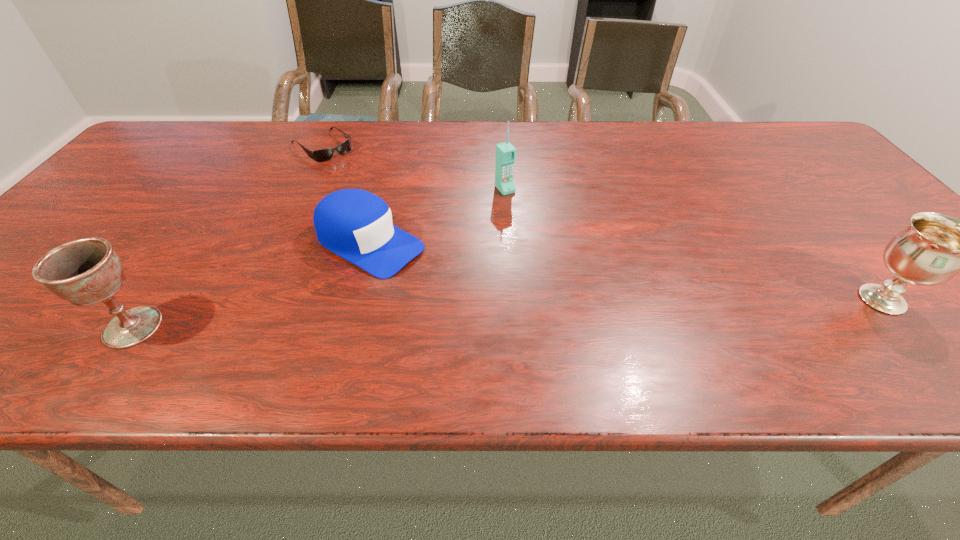
Where is `free space on the desktop that is between the leftmost object and the rightmost object and is positioned on the keypad of the second farthest object`? free space on the desktop that is between the leftmost object and the rightmost object and is positioned on the keypad of the second farthest object is located at coordinates (611, 309).

The image size is (960, 540). Identify the location of free space on the desktop that is between the left chalice and the right chalice and is positioned on the front-facing side of the farthest object. (516, 313).

Locate an element on the screen. free spot on the desktop that is between the left chalice and the rightmost object and is positioned on the front-facing side of the third farthest object is located at coordinates (497, 314).